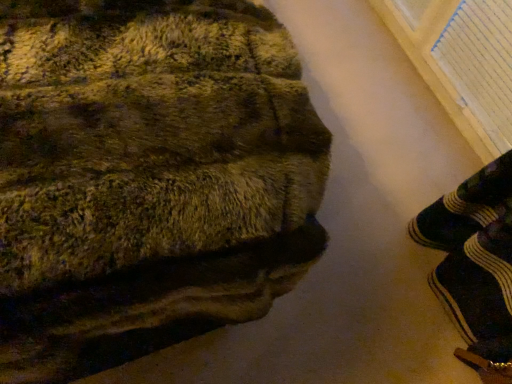
At what (x,y) coordinates should I click in order to perform the action: click on textured green towel at upper left. Please return your answer as a coordinate pair (x, y). The height and width of the screenshot is (384, 512). Looking at the image, I should click on (147, 177).

This screenshot has width=512, height=384. What do you see at coordinates (147, 177) in the screenshot? I see `textured green towel at upper left` at bounding box center [147, 177].

The height and width of the screenshot is (384, 512). Identify the location of textured green towel at upper left. (147, 177).